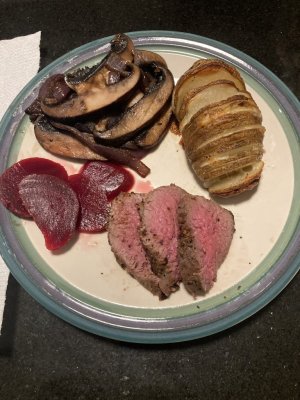
Where is `sparkles in artificial surface of table`? sparkles in artificial surface of table is located at coordinates (257, 337), (272, 328), (272, 311), (284, 366), (78, 366), (54, 371), (28, 369).